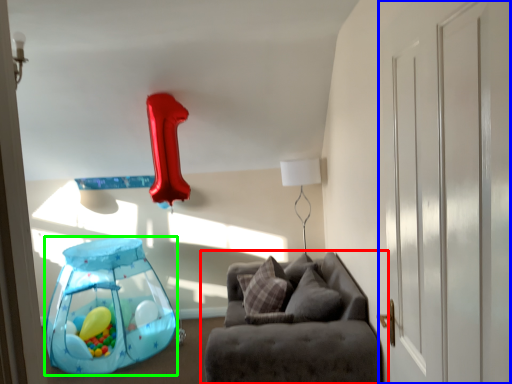
Question: Which object is the farthest from studio couch (highlighted by a red box)? Choose among these: glass door (highlighted by a blue box) or balloon (highlighted by a green box).

Choices:
 (A) glass door
 (B) balloon

Answer: (B)